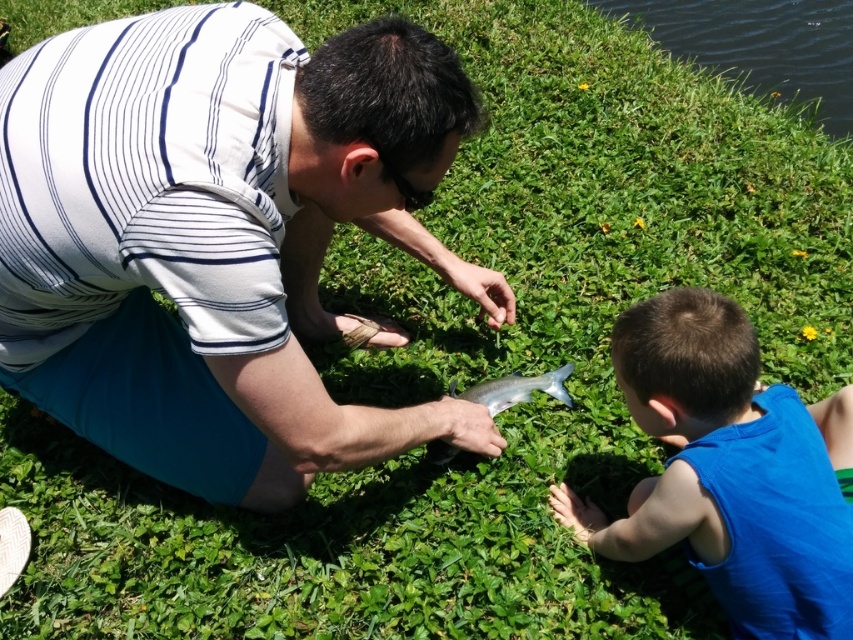
Question: Among these points, which one is nearest to the camera?

Choices:
 (A) (62, 211)
 (B) (741, 19)
 (C) (751, 404)
 (D) (463, 392)

Answer: (A)

Question: Which point is farther from the camera taking this photo?

Choices:
 (A) (170, 195)
 (B) (752, 22)
 (C) (502, 381)
 (D) (730, 364)

Answer: (B)

Question: Based on their relative distances, which object is farther from the green grassy water at upper right?

Choices:
 (A) shiny metallic fish at center
 (B) blue matte shirt at lower right
 (C) matte white shirt at center

Answer: (C)

Question: Is blue matte shirt at lower right bigger than green grassy water at upper right?

Choices:
 (A) no
 (B) yes

Answer: (A)

Question: Does blue matte shirt at lower right have a smaller size compared to green grassy water at upper right?

Choices:
 (A) yes
 (B) no

Answer: (A)

Question: Is matte white shirt at center further to camera compared to blue matte shirt at lower right?

Choices:
 (A) yes
 (B) no

Answer: (B)